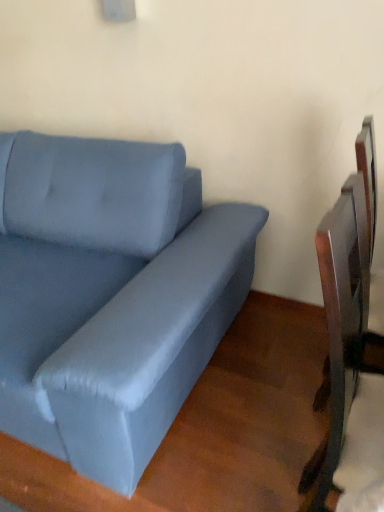
Where is `satin blue couch at left`? Image resolution: width=384 pixels, height=512 pixels. satin blue couch at left is located at coordinates (110, 295).

What do you see at coordinates (110, 295) in the screenshot? The image size is (384, 512). I see `satin blue couch at left` at bounding box center [110, 295].

What do you see at coordinates (351, 344) in the screenshot? The width and height of the screenshot is (384, 512). I see `metallic silver swivel chair at right` at bounding box center [351, 344].

I want to click on metallic silver swivel chair at right, so click(351, 344).

Measure the distance between point (368, 308) and camera.

The depth of point (368, 308) is 35.98 inches.

The height and width of the screenshot is (512, 384). In order to click on satin blue couch at left in this screenshot , I will do `click(110, 295)`.

Is metallic silver swivel chair at right to the right of satin blue couch at left from the viewer's perspective?

Yes, metallic silver swivel chair at right is to the right of satin blue couch at left.

Considering the positions of objects metallic silver swivel chair at right and satin blue couch at left in the image provided, who is behind, metallic silver swivel chair at right or satin blue couch at left?

Positioned behind is metallic silver swivel chair at right.

Is point (367, 411) closer or farther from the camera than point (167, 230)?

Point (367, 411) is positioned closer to the camera compared to point (167, 230).

From the image's perspective, is metallic silver swivel chair at right positioned above or below satin blue couch at left?

Clearly, from the image's perspective, metallic silver swivel chair at right is below satin blue couch at left.

From a real-world perspective, is metallic silver swivel chair at right physically below satin blue couch at left?

Actually, metallic silver swivel chair at right is physically above satin blue couch at left in the real world.

In terms of width, does metallic silver swivel chair at right look wider or thinner when compared to satin blue couch at left?

metallic silver swivel chair at right is thinner than satin blue couch at left.

Between metallic silver swivel chair at right and satin blue couch at left, which one has less height?

With less height is satin blue couch at left.

Does metallic silver swivel chair at right have a larger size compared to satin blue couch at left?

No.

Would you say metallic silver swivel chair at right contains satin blue couch at left?

No, satin blue couch at left is not surrounded by metallic silver swivel chair at right.

Can you see metallic silver swivel chair at right touching satin blue couch at left?

They are not placed beside each other.

Is metallic silver swivel chair at right turned away from satin blue couch at left?

Correct, metallic silver swivel chair at right is looking away from satin blue couch at left.

How much distance is there between metallic silver swivel chair at right and satin blue couch at left?

metallic silver swivel chair at right is 28.66 inches from satin blue couch at left.

You are a GUI agent. You are given a task and a screenshot of the screen. Output one action in this format:
    pyautogui.click(x=<x>, y=<y>)
    Task: Click on the studio couch above the metallic silver swivel chair at right (from the image's perspective)
    The height and width of the screenshot is (512, 384).
    Given the screenshot: What is the action you would take?
    pyautogui.click(x=110, y=295)

Is satin blue couch at left to the right of metallic silver swivel chair at right from the viewer's perspective?

Incorrect, satin blue couch at left is not on the right side of metallic silver swivel chair at right.

Between satin blue couch at left and metallic silver swivel chair at right, which one is positioned in front?

satin blue couch at left is closer to the camera.

Is point (54, 407) farther from camera compared to point (328, 463)?

Yes, it is behind point (328, 463).

From the image's perspective, does satin blue couch at left appear higher than metallic silver swivel chair at right?

Yes.

From a real-world perspective, is satin blue couch at left physically located above or below metallic silver swivel chair at right?

Clearly, from a real-world perspective, satin blue couch at left is below metallic silver swivel chair at right.

Looking at their sizes, would you say satin blue couch at left is wider or thinner than metallic silver swivel chair at right?

In the image, satin blue couch at left appears to be wider than metallic silver swivel chair at right.

Is satin blue couch at left taller than metallic silver swivel chair at right?

No, satin blue couch at left is not taller than metallic silver swivel chair at right.

Which of these two, satin blue couch at left or metallic silver swivel chair at right, is smaller?

metallic silver swivel chair at right is smaller.

Choose the correct answer: Is satin blue couch at left inside metallic silver swivel chair at right or outside it?

satin blue couch at left is located beyond the bounds of metallic silver swivel chair at right.

Would you say satin blue couch at left is a long distance from metallic silver swivel chair at right?

satin blue couch at left is near metallic silver swivel chair at right, not far away.

Is satin blue couch at left facing towards metallic silver swivel chair at right?

No, satin blue couch at left is not oriented towards metallic silver swivel chair at right.

The height and width of the screenshot is (512, 384). What are the coordinates of `studio couch that appears above the metallic silver swivel chair at right (from the image's perspective)` in the screenshot? It's located at (110, 295).

The height and width of the screenshot is (512, 384). What are the coordinates of `studio couch below the metallic silver swivel chair at right (from a real-world perspective)` in the screenshot? It's located at (110, 295).

Identify the location of studio couch on the left of metallic silver swivel chair at right. Image resolution: width=384 pixels, height=512 pixels. (110, 295).